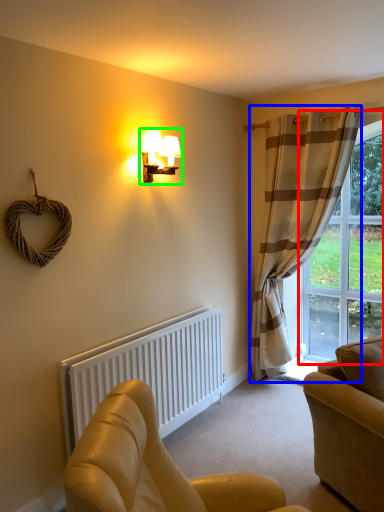
Question: Which object is positioned closest to window (highlighted by a red box)? Select from curtain (highlighted by a blue box) and lamp (highlighted by a green box).

Choices:
 (A) curtain
 (B) lamp

Answer: (A)